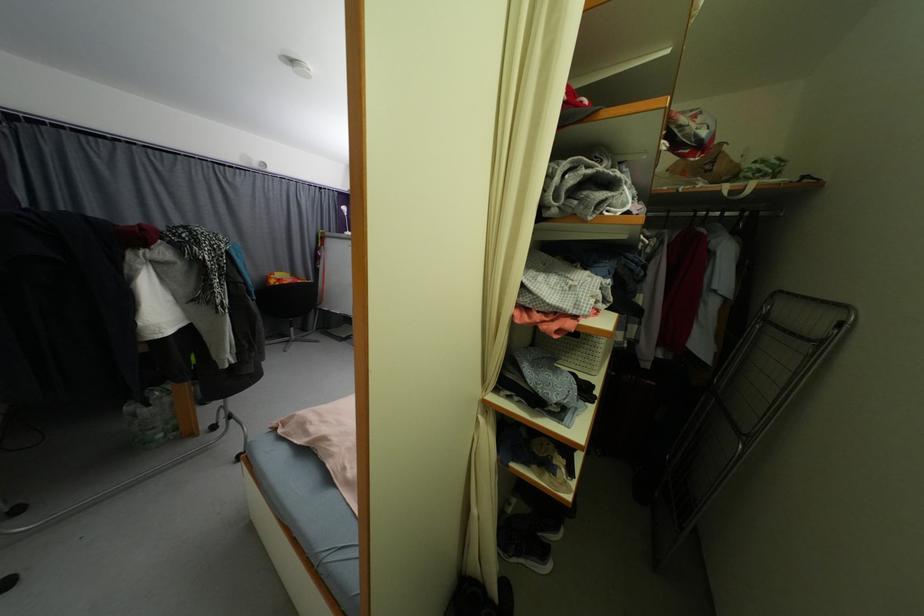
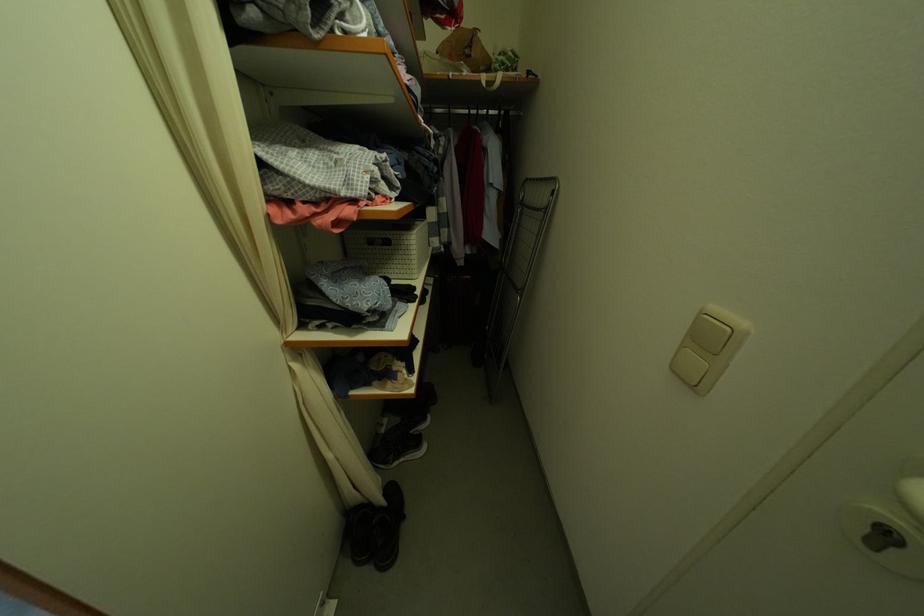
In the second image, find the point that corresponds to (x=589, y=366) in the first image.

(407, 273)